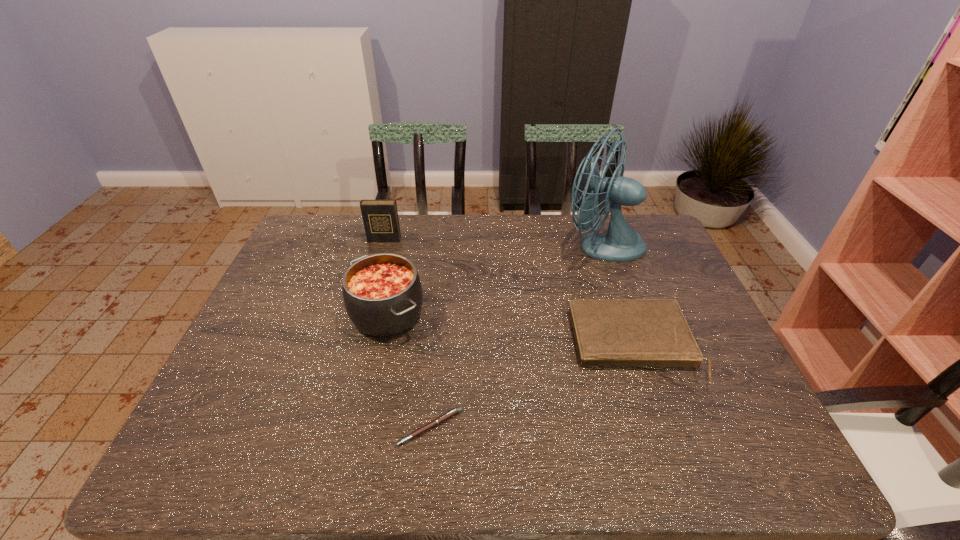
Identify the location of free location at the left edge. This screenshot has height=540, width=960. (251, 345).

Where is `free space at the right edge of the desktop`? free space at the right edge of the desktop is located at coordinates (696, 331).

Identify the location of vacant space at the far left corner of the desktop. The height and width of the screenshot is (540, 960). (297, 242).

Find the location of a particular element. Image resolution: width=960 pixels, height=540 pixels. free space at the near left corner is located at coordinates (213, 461).

Locate an element on the screen. The height and width of the screenshot is (540, 960). vacant space at the far right corner of the desktop is located at coordinates (638, 232).

Find the location of a particular element. blank region between the fan and the casserole is located at coordinates (494, 279).

Locate an element on the screen. This screenshot has height=540, width=960. blank region between the nearest object and the diary is located at coordinates (407, 333).

Locate an element on the screen. The image size is (960, 540). vacant region between the diary and the paperback book is located at coordinates (509, 293).

Identify the location of free area in between the fan and the shortest object. This screenshot has height=540, width=960. (516, 336).

Locate an element on the screen. This screenshot has height=540, width=960. vacant space that's between the second shortest object and the pen is located at coordinates (532, 387).